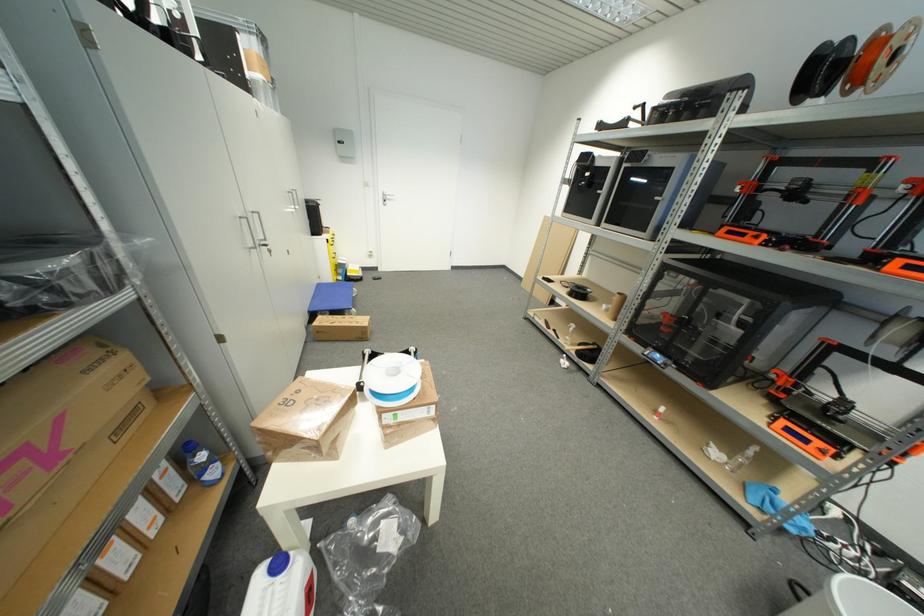
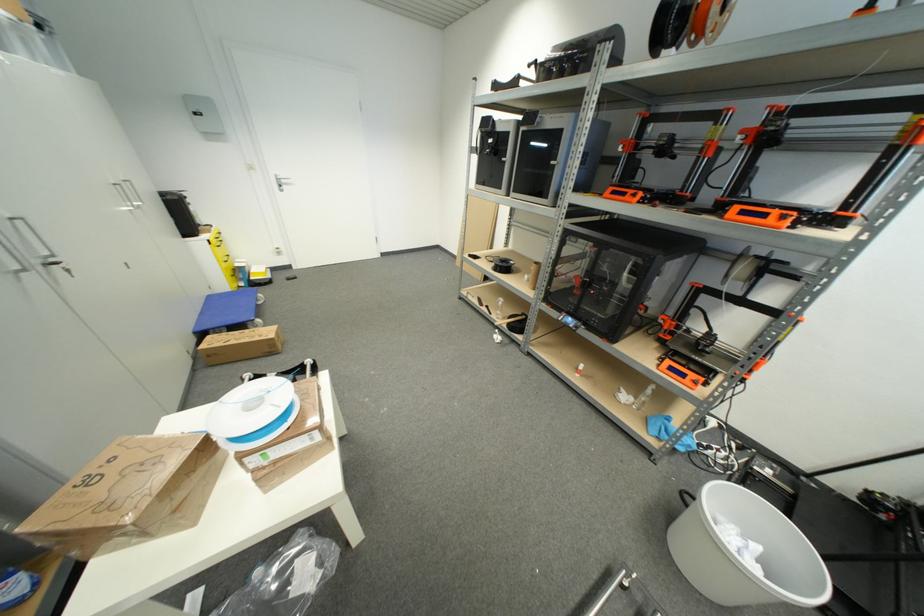
In the second image, find the point that corresponds to pixel 322 286 in the first image.

(213, 299)